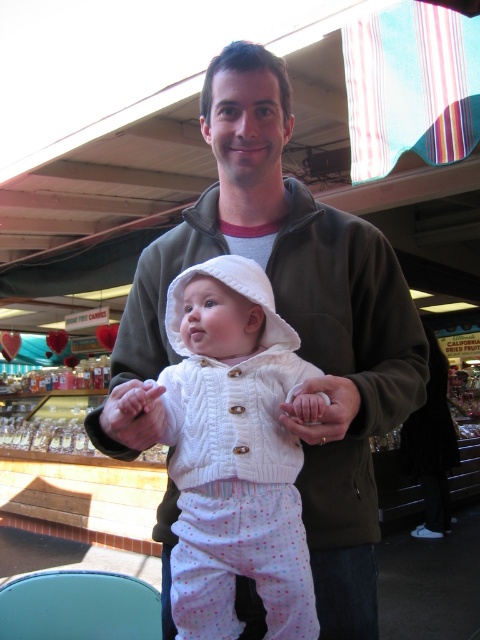
Does matte brown jacket at center have a greater width compared to white soft baby hand at center?

Indeed, matte brown jacket at center has a greater width compared to white soft baby hand at center.

Which is in front, point (308, 468) or point (154, 406)?

Positioned in front is point (154, 406).

At what (x,y) coordinates should I click in order to perform the action: click on matte brown jacket at center. Please return your answer as a coordinate pair (x, y). Looking at the image, I should click on [x=296, y=314].

Does white knitted sweater at center have a greater height compared to white soft baby hand at center?

Yes.

Does white knitted sweater at center have a smaller size compared to white soft baby hand at center?

No.

At what (x,y) coordinates should I click in order to perform the action: click on white knitted sweater at center. Please return your answer as a coordinate pair (x, y). The image size is (480, 640). Looking at the image, I should click on (233, 452).

The image size is (480, 640). I want to click on white knitted sweater at center, so click(x=233, y=452).

Is matte brown jacket at center wider than matte white hand at center?

Correct, the width of matte brown jacket at center exceeds that of matte white hand at center.

Does matte brown jacket at center have a greater height compared to matte white hand at center?

Yes, matte brown jacket at center is taller than matte white hand at center.

Is point (156, 339) farther from camera compared to point (322, 429)?

Yes.

Find the location of a particular element. This screenshot has height=640, width=480. matte brown jacket at center is located at coordinates (296, 314).